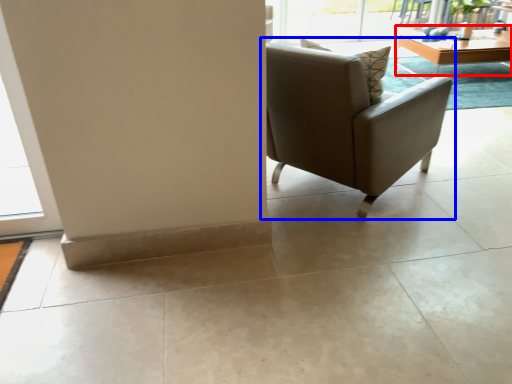
Question: Which object is further to the camera taking this photo, table (highlighted by a red box) or chair (highlighted by a blue box)?

Choices:
 (A) table
 (B) chair

Answer: (A)